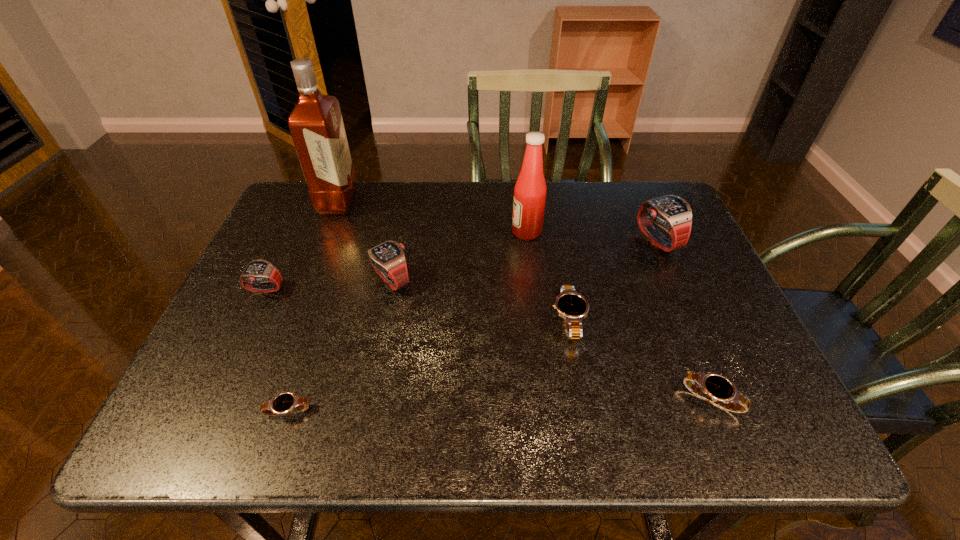
Locate an element on the screen. watch that can be found as the second closest to the condiment is located at coordinates (672, 213).

Locate which watch is the fifth closest to the fifth tallest object. Please provide its 2D coordinates. Your answer should be formatted as a tuple, i.e. [(x, y)], where the tuple contains the x and y coordinates of a point satisfying the conditions above.

[(672, 213)]

Locate an element on the screen. This screenshot has height=540, width=960. red watch that stands as the third closest to the second shortest object is located at coordinates (257, 271).

Select which red watch appears as the third closest to the second biggest black watch. Please provide its 2D coordinates. Your answer should be formatted as a tuple, i.e. [(x, y)], where the tuple contains the x and y coordinates of a point satisfying the conditions above.

[(257, 271)]

This screenshot has height=540, width=960. In order to click on the second closest black watch to the tallest watch in this screenshot , I will do `click(715, 387)`.

Identify which black watch is the nearest to the second smallest red watch. Please provide its 2D coordinates. Your answer should be formatted as a tuple, i.e. [(x, y)], where the tuple contains the x and y coordinates of a point satisfying the conditions above.

[(284, 403)]

Locate an element on the screen. Image resolution: width=960 pixels, height=540 pixels. vacant space that satisfies the following two spatial constraints: 1. on the front label of the tallest object; 2. on the left side of the fourth object from left to right is located at coordinates (308, 280).

The height and width of the screenshot is (540, 960). Find the location of `vacant position in the image that satisfies the following two spatial constraints: 1. on the front-facing side of the biggest red watch; 2. on the right side of the red condiment`. vacant position in the image that satisfies the following two spatial constraints: 1. on the front-facing side of the biggest red watch; 2. on the right side of the red condiment is located at coordinates (528, 241).

I want to click on vacant space that satisfies the following two spatial constraints: 1. on the front label of the tallest object; 2. on the back side of the shortest object, so (257, 410).

In order to click on vacant space that satisfies the following two spatial constraints: 1. on the front-facing side of the rightmost red watch; 2. on the right side of the condiment in this screenshot , I will do `click(528, 241)`.